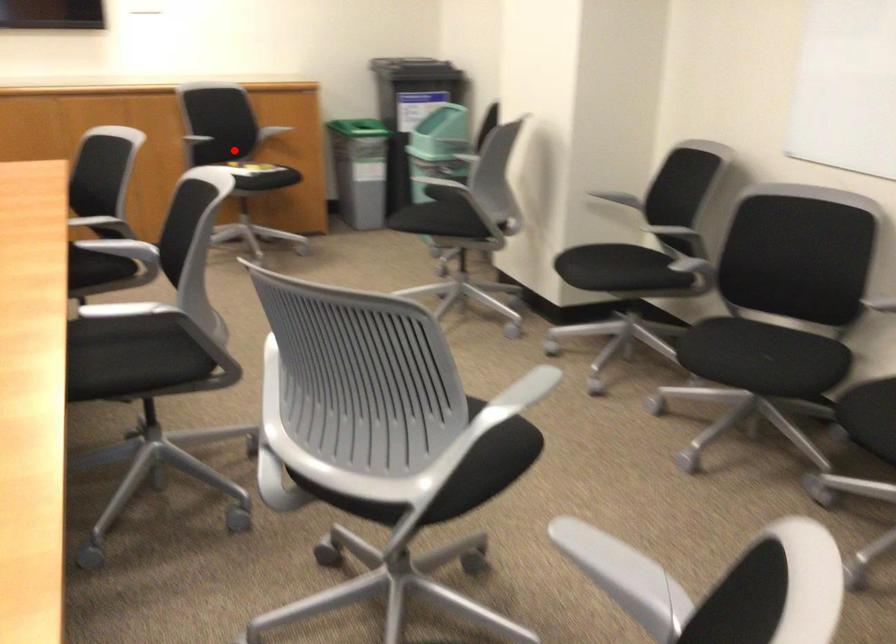
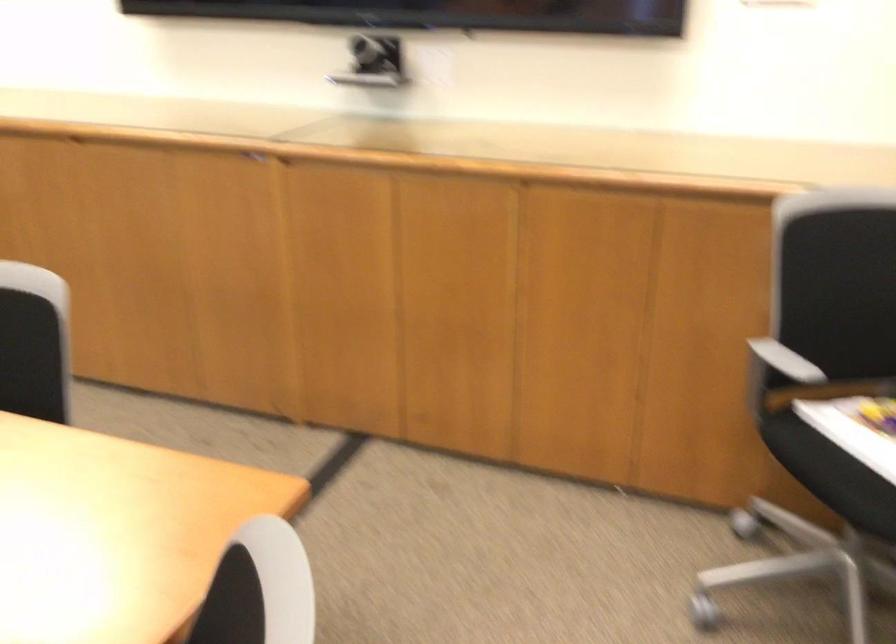
Find the pixel in the second image that matches the highlighted location in the first image.

(857, 428)